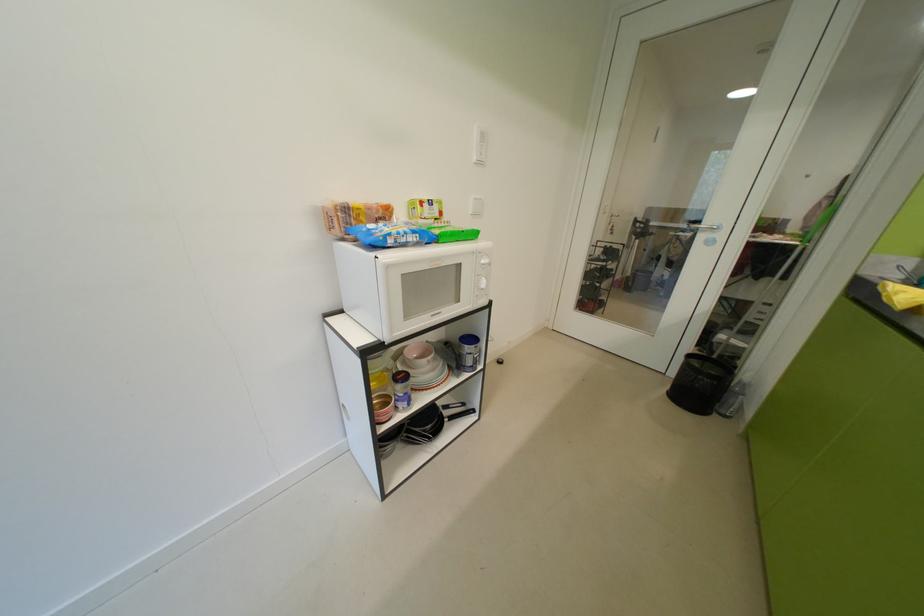
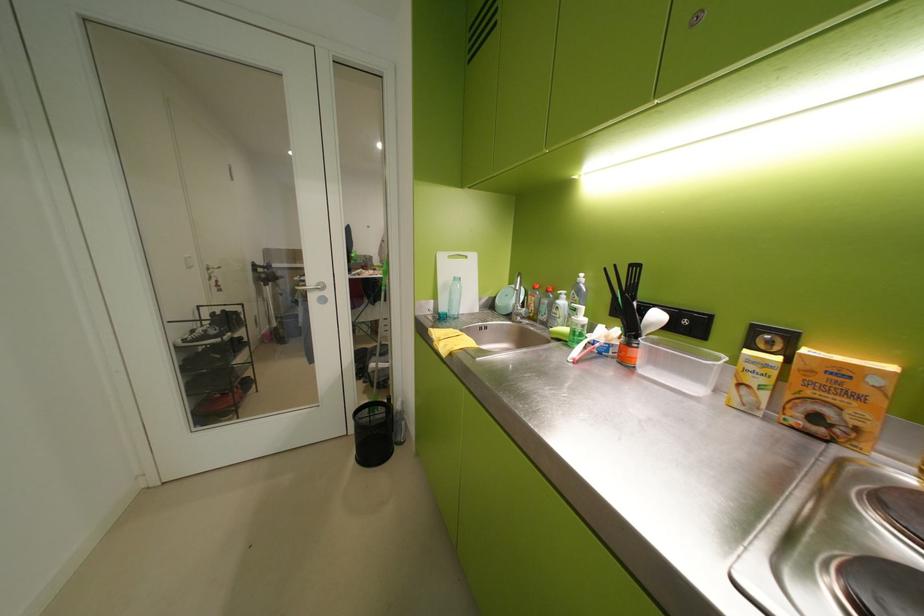
Question: The camera is either moving clockwise (left) or counter-clockwise (right) around the object. The first image is from the beginning of the video and the second image is from the end. Is the camera moving left or right when shooting the video?

Choices:
 (A) Left
 (B) Right

Answer: (A)